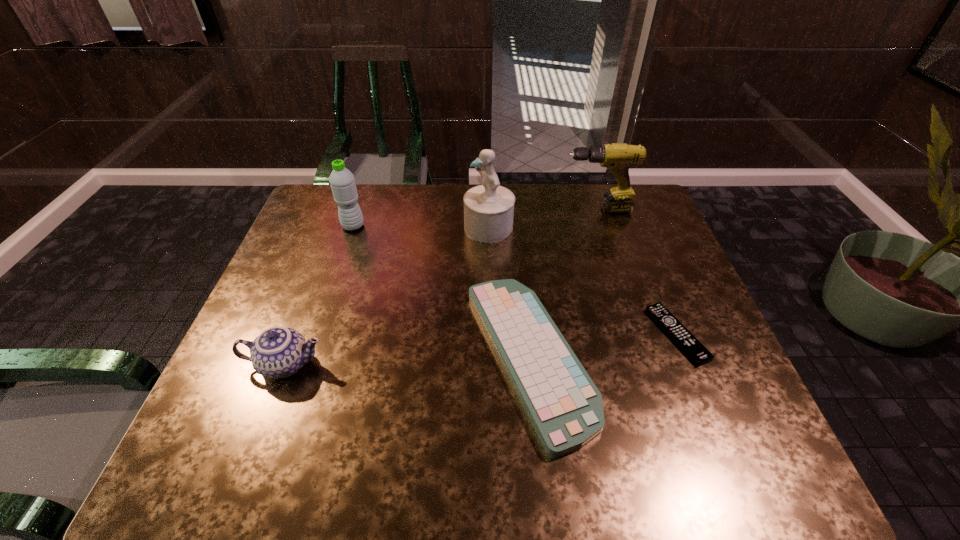
Find the location of a particular element. The width and height of the screenshot is (960, 540). water bottle located at the left edge is located at coordinates (342, 182).

The width and height of the screenshot is (960, 540). What are the coordinates of `chinaware that is at the left edge` in the screenshot? It's located at (278, 352).

Identify the location of drill present at the right edge. The height and width of the screenshot is (540, 960). point(617,157).

Where is `remote control that is at the right edge`? The width and height of the screenshot is (960, 540). remote control that is at the right edge is located at coordinates (681, 336).

I want to click on object located in the far left corner section of the desktop, so click(x=342, y=182).

Locate an element on the screen. The image size is (960, 540). object at the far right corner is located at coordinates (617, 157).

Where is `free space at the far edge`? The width and height of the screenshot is (960, 540). free space at the far edge is located at coordinates (454, 218).

Where is `vacant area at the near edge`? The height and width of the screenshot is (540, 960). vacant area at the near edge is located at coordinates (529, 438).

This screenshot has width=960, height=540. In order to click on vacant area at the left edge of the desktop in this screenshot , I will do [270, 427].

This screenshot has height=540, width=960. I want to click on free point at the right edge, so click(x=679, y=362).